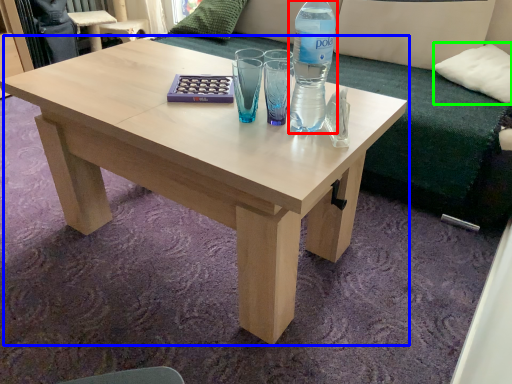
Question: Which is farther away from bottle (highlighted by a red box)? coffee table (highlighted by a blue box) or pillow (highlighted by a green box)?

Choices:
 (A) coffee table
 (B) pillow

Answer: (B)